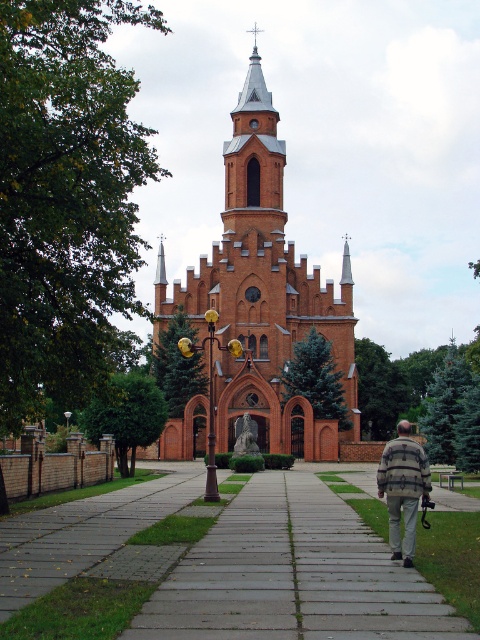
Question: Can you confirm if brick church at center is smaller than gray concrete pavement at center?

Choices:
 (A) yes
 (B) no

Answer: (B)

Question: Is brick church at center bigger than gray concrete pavement at center?

Choices:
 (A) yes
 (B) no

Answer: (A)

Question: Is brick church at center smaller than gray concrete pavement at center?

Choices:
 (A) no
 (B) yes

Answer: (A)

Question: Which object is the farthest from the gray concrete pavement at center?

Choices:
 (A) striped fabric jacket at center
 (B) brick church at center

Answer: (B)

Question: Estimate the real-world distances between objects in this image. Which object is farther from the striped fabric jacket at center?

Choices:
 (A) brick church at center
 (B) gray concrete pavement at center

Answer: (A)

Question: Which point is farther to the camera?

Choices:
 (A) (277, 604)
 (B) (389, 538)
 (C) (186, 285)

Answer: (C)